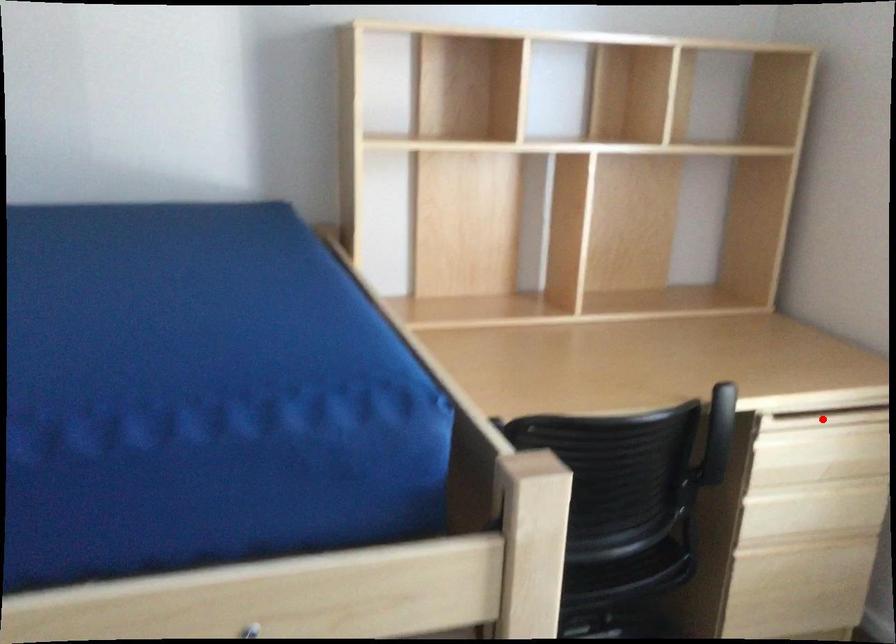
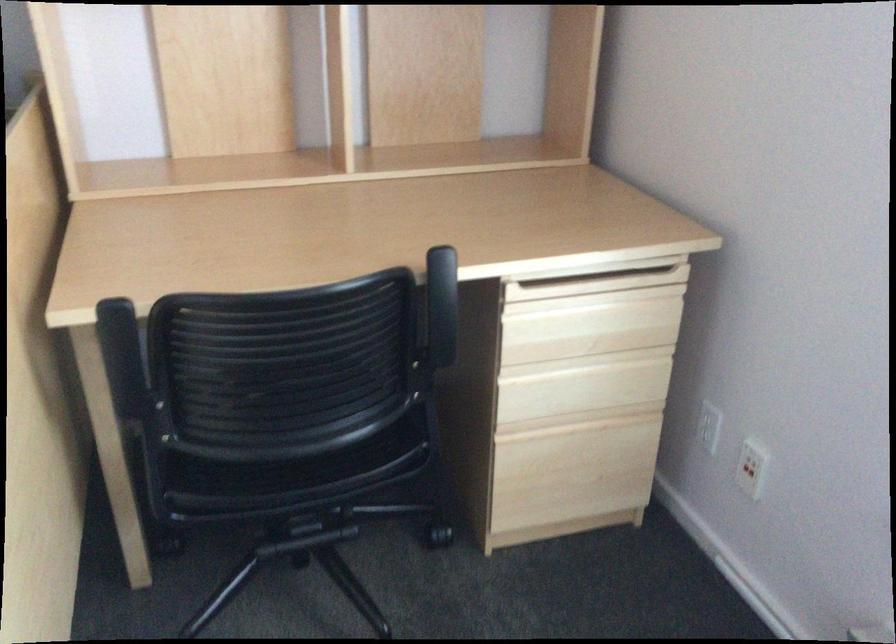
Question: A red point is marked in image1. In image2, is the corresponding 3D point closer to the camera or farther? Reply with the corresponding letter.

Choices:
 (A) The corresponding 3D point is closer.
 (B) The corresponding 3D point is farther.

Answer: (A)